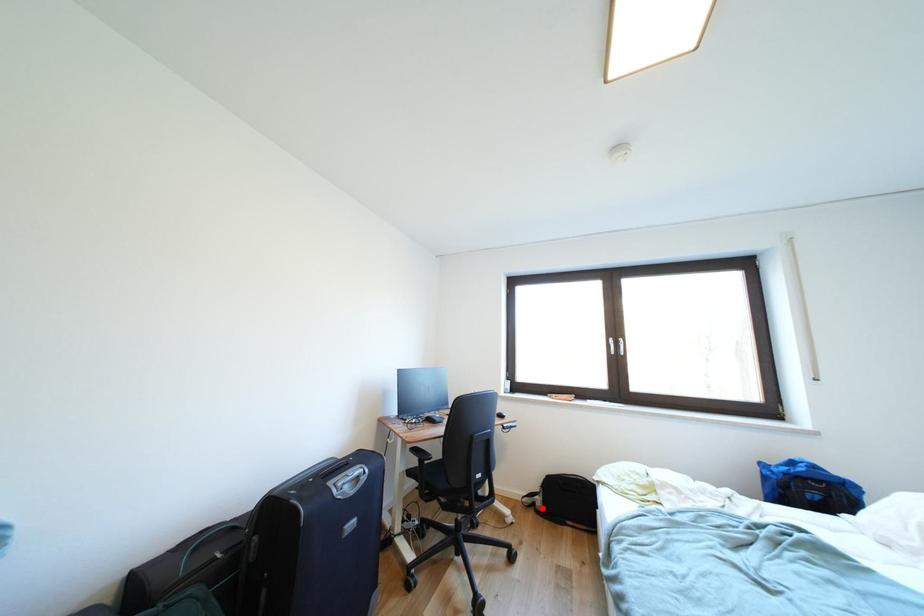
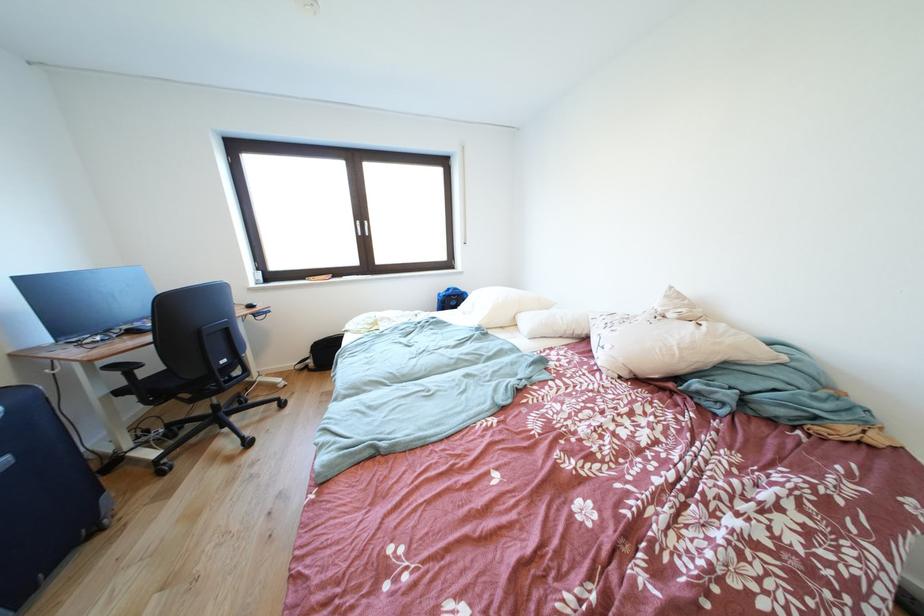
Question: I am providing you with two images of the same scene from different viewpoints. In image1, a red point is highlighted. Considering the same 3D point in image2, which of the following is correct?

Choices:
 (A) It is closer
 (B) It is farther

Answer: (B)